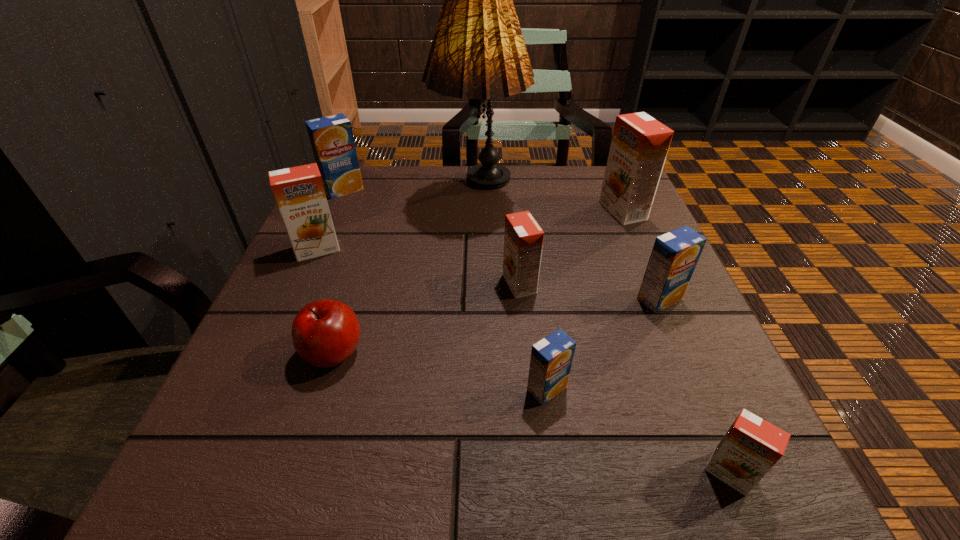
You are a GUI agent. You are given a task and a screenshot of the screen. Output one action in this format:
    pyautogui.click(x=<x>, y=<y>)
    Task: Click on the rightmost blue orange_juice
    This screenshot has width=960, height=540.
    Given the screenshot: What is the action you would take?
    pyautogui.click(x=674, y=256)

This screenshot has width=960, height=540. Find the location of `pink apple`. pink apple is located at coordinates (325, 333).

Locate an element on the screen. The image size is (960, 540). the smallest blue orange_juice is located at coordinates (551, 358).

Locate an element on the screen. This screenshot has height=540, width=960. the nearest blue orange_juice is located at coordinates (551, 358).

Locate an element on the screen. The width and height of the screenshot is (960, 540). the nearest object is located at coordinates (751, 447).

Where is `the smallest orange orange juice`? the smallest orange orange juice is located at coordinates (751, 447).

Identify the location of free space located on the front-facing side of the lampshade. Image resolution: width=960 pixels, height=540 pixels. (478, 308).

Identify the location of free space located on the left of the farthest orange orange juice. The image size is (960, 540). (510, 211).

At what (x,y) coordinates should I click in order to perform the action: click on free spot located 0.370m on the right of the leftmost blue orange_juice. Please return your answer as a coordinate pair (x, y). Image resolution: width=960 pixels, height=540 pixels. Looking at the image, I should click on (509, 190).

Image resolution: width=960 pixels, height=540 pixels. I want to click on blank space located 0.260m on the front of the third farthest orange juice, so click(x=266, y=364).